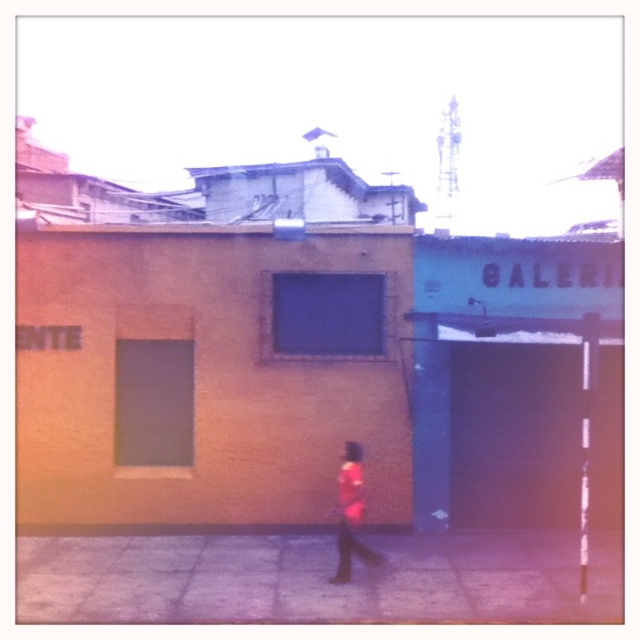
Question: Can you confirm if matte orange wall at center is thinner than gray concrete pavement at lower center?

Choices:
 (A) no
 (B) yes

Answer: (B)

Question: Which point is farther from the camera taking this photo?

Choices:
 (A) (385, 280)
 (B) (268, 618)

Answer: (A)

Question: Is gray concrete pavement at lower center smaller than pink fabric dress at center?

Choices:
 (A) yes
 (B) no

Answer: (B)

Question: Which point appears closest to the camera in this image?

Choices:
 (A) (330, 579)
 (B) (204, 413)

Answer: (A)

Question: Which point is closer to the camera taking this photo?

Choices:
 (A) (596, 556)
 (B) (156, 292)

Answer: (A)

Question: Is the position of gray concrete pavement at lower center more distant than that of pink fabric dress at center?

Choices:
 (A) no
 (B) yes

Answer: (A)